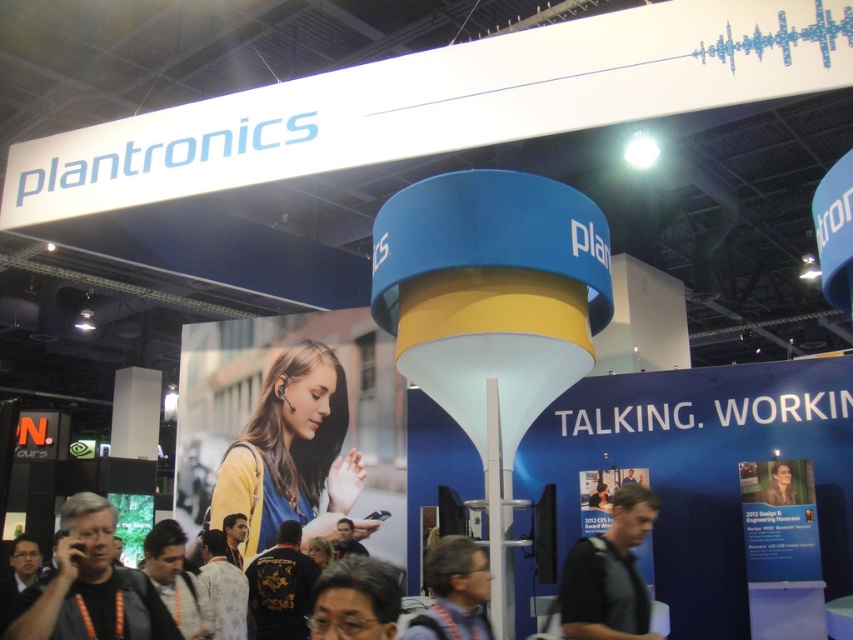
Between point (341, 480) and point (769, 483), which one is positioned in front?

Positioned in front is point (769, 483).

Identify the location of yellow matte earbud at center. Image resolution: width=853 pixels, height=640 pixels. (289, 452).

Who is positioned more to the right, matte black glasses at lower center or matte black woman at center?

matte black woman at center is more to the right.

Measure the distance between point (x=392, y=612) and camera.

They are 4.00 meters apart.

Image resolution: width=853 pixels, height=640 pixels. What do you see at coordinates (357, 600) in the screenshot? I see `matte black glasses at lower center` at bounding box center [357, 600].

What are the coordinates of `matte black glasses at lower center` in the screenshot? It's located at (357, 600).

Consider the image. Who is more forward, [463,588] or [769,500]?

Point [463,588]

Which is more to the left, gray fabric glasses at lower center or matte black woman at center?

gray fabric glasses at lower center

Is point (450, 541) less distant than point (772, 480)?

That is True.

The height and width of the screenshot is (640, 853). Find the location of `gray fabric glasses at lower center`. gray fabric glasses at lower center is located at coordinates (454, 593).